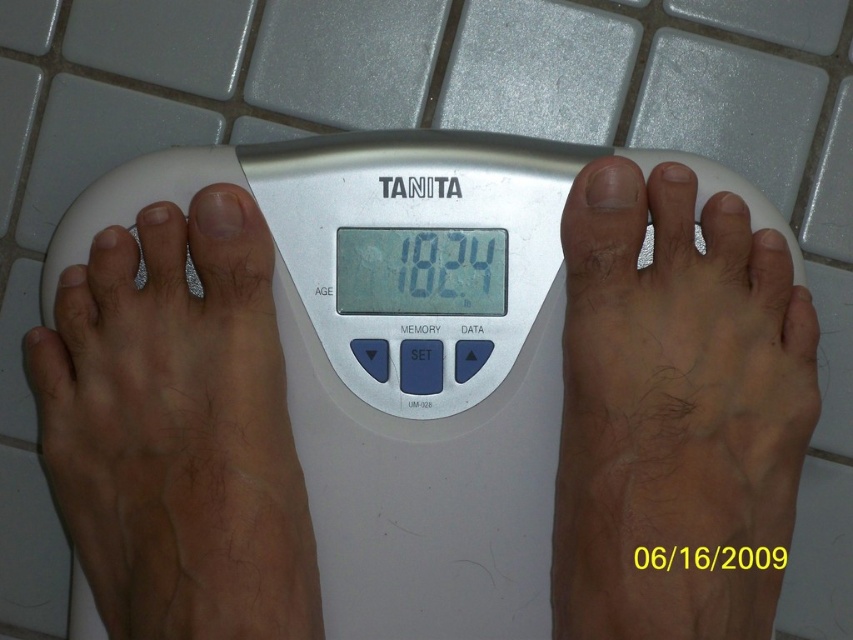
Question: Does white plastic weight scale at center have a greater width compared to light brown skin at left?

Choices:
 (A) no
 (B) yes

Answer: (B)

Question: Where is dry skin foot at center located in relation to light brown skin at left in the image?

Choices:
 (A) below
 (B) above

Answer: (B)

Question: Among these objects, which one is nearest to the camera?

Choices:
 (A) dry skin foot at center
 (B) light brown skin at left

Answer: (B)

Question: Which object is farther from the camera taking this photo?

Choices:
 (A) dry skin foot at center
 (B) light brown skin at left
 (C) white plastic weight scale at center

Answer: (C)

Question: Among these points, which one is nearest to the camera?

Choices:
 (A) (563, 580)
 (B) (561, 292)
 (C) (167, 316)

Answer: (A)

Question: Is white plastic weight scale at center in front of light brown skin at left?

Choices:
 (A) no
 (B) yes

Answer: (A)